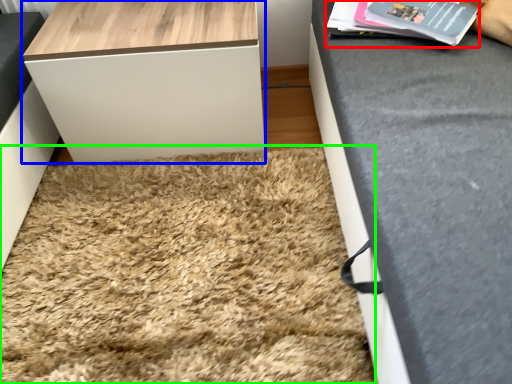
Question: Which object is positioned farthest from magazine (highlighted by a red box)? Select from table (highlighted by a blue box) and mat (highlighted by a green box).

Choices:
 (A) table
 (B) mat

Answer: (B)